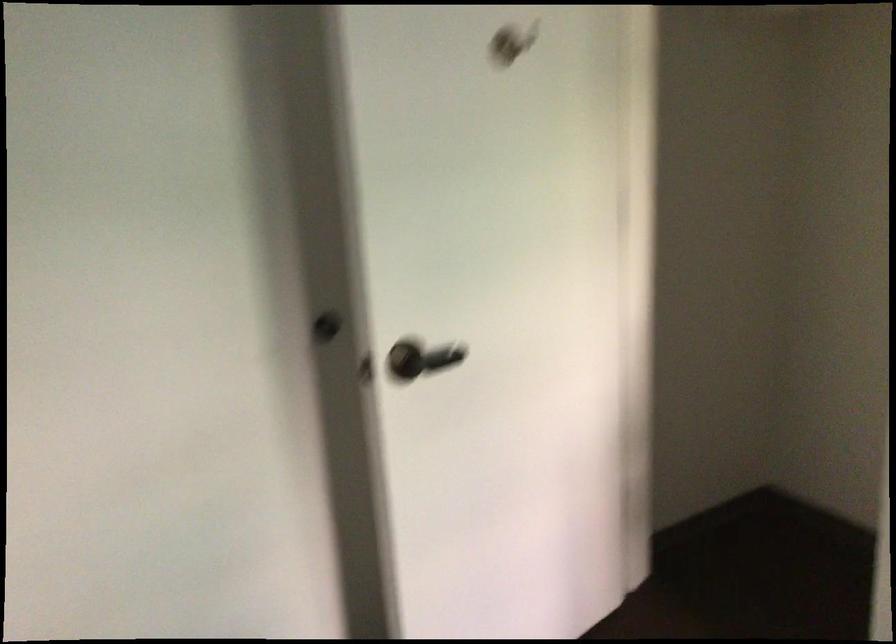
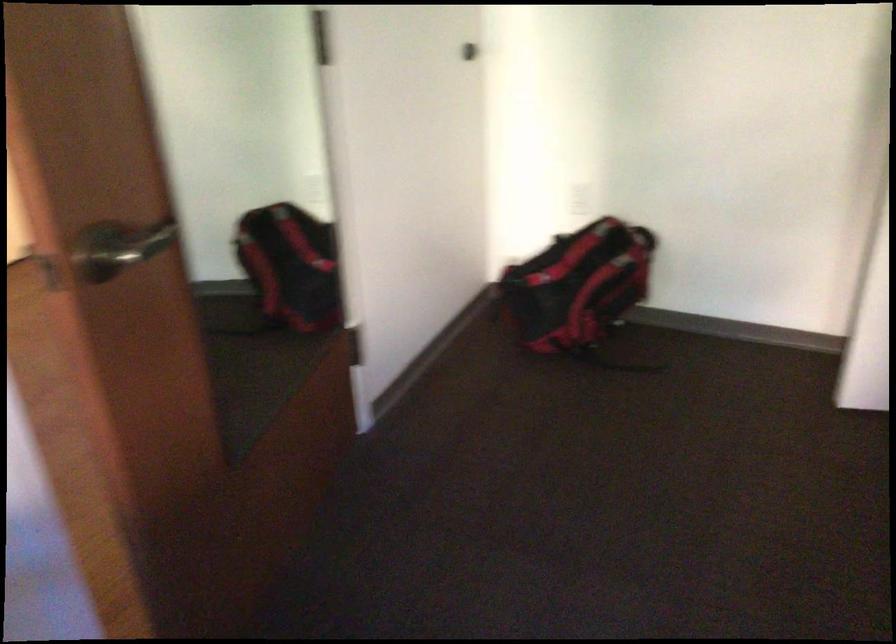
Based on the continuous images, in which direction is the camera rotating?

The camera rotated toward left-down.